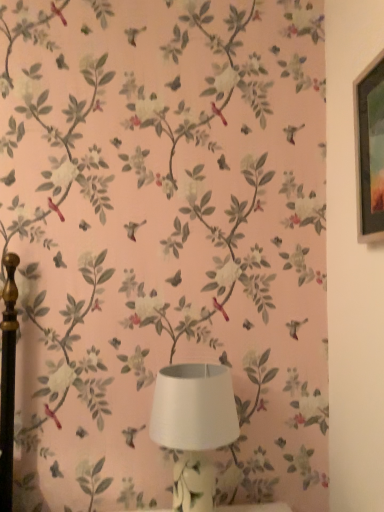
What do you see at coordinates (194, 426) in the screenshot? The width and height of the screenshot is (384, 512). I see `white matte lampshade at center` at bounding box center [194, 426].

Find the location of a particular element. This screenshot has width=384, height=512. white matte lampshade at center is located at coordinates (194, 426).

Measure the distance between metallic silver picture frame at upper right and camera.

metallic silver picture frame at upper right and camera are 38.04 inches apart.

What are the coordinates of `metallic silver picture frame at upper right` in the screenshot? It's located at (370, 150).

The height and width of the screenshot is (512, 384). Describe the element at coordinates (370, 150) in the screenshot. I see `metallic silver picture frame at upper right` at that location.

Find the location of a particular element. Image resolution: width=384 pixels, height=512 pixels. white matte lampshade at center is located at coordinates (194, 426).

Is white matte lampshade at center to the left of metallic silver picture frame at upper right from the viewer's perspective?

Indeed, white matte lampshade at center is positioned on the left side of metallic silver picture frame at upper right.

Is white matte lampshade at center closer to camera compared to metallic silver picture frame at upper right?

No, it is behind metallic silver picture frame at upper right.

Which is in front, point (160, 409) or point (366, 223)?

The point (366, 223) is in front.

From the image's perspective, which object appears higher, white matte lampshade at center or metallic silver picture frame at upper right?

metallic silver picture frame at upper right.

From a real-world perspective, between white matte lampshade at center and metallic silver picture frame at upper right, who is vertically lower?

white matte lampshade at center is physically lower.

Can you confirm if white matte lampshade at center is wider than metallic silver picture frame at upper right?

Yes.

Can you confirm if white matte lampshade at center is taller than metallic silver picture frame at upper right?

No.

Which of these two, white matte lampshade at center or metallic silver picture frame at upper right, is smaller?

With smaller size is metallic silver picture frame at upper right.

Based on the photo, is white matte lampshade at center not inside metallic silver picture frame at upper right?

Absolutely, white matte lampshade at center is external to metallic silver picture frame at upper right.

Would you consider white matte lampshade at center to be distant from metallic silver picture frame at upper right?

Actually, white matte lampshade at center and metallic silver picture frame at upper right are a little close together.

Is white matte lampshade at center facing towards metallic silver picture frame at upper right?

No.

Where is `lamp below the metallic silver picture frame at upper right (from the image's perspective)`? This screenshot has width=384, height=512. lamp below the metallic silver picture frame at upper right (from the image's perspective) is located at coordinates (194, 426).

Based on their positions, is metallic silver picture frame at upper right located to the left or right of white matte lampshade at center?

From the image, it's evident that metallic silver picture frame at upper right is to the right of white matte lampshade at center.

Does metallic silver picture frame at upper right lie behind white matte lampshade at center?

No, metallic silver picture frame at upper right is closer to the camera.

Which point is more distant from viewer, (x=378, y=198) or (x=188, y=456)?

The point (x=188, y=456) is farther from the camera.

From the image's perspective, between metallic silver picture frame at upper right and white matte lampshade at center, which one is located above?

metallic silver picture frame at upper right.

From a real-world perspective, is metallic silver picture frame at upper right positioned above or below white matte lampshade at center?

metallic silver picture frame at upper right is situated higher than white matte lampshade at center in the real world.

Which of these two, metallic silver picture frame at upper right or white matte lampshade at center, is thinner?

metallic silver picture frame at upper right is thinner.

Looking at this image, considering the sizes of objects metallic silver picture frame at upper right and white matte lampshade at center in the image provided, who is shorter, metallic silver picture frame at upper right or white matte lampshade at center?

Standing shorter between the two is white matte lampshade at center.

Between metallic silver picture frame at upper right and white matte lampshade at center, which one has larger size?

white matte lampshade at center.

Is metallic silver picture frame at upper right not within white matte lampshade at center?

Absolutely, metallic silver picture frame at upper right is external to white matte lampshade at center.

Would you consider metallic silver picture frame at upper right to be distant from white matte lampshade at center?

No, metallic silver picture frame at upper right is not far away from white matte lampshade at center.

Is metallic silver picture frame at upper right positioned with its back to white matte lampshade at center?

No, metallic silver picture frame at upper right is not facing the opposite direction of white matte lampshade at center.

Based on the photo, how much distance is there between metallic silver picture frame at upper right and white matte lampshade at center?

Result: metallic silver picture frame at upper right is 26.53 inches away from white matte lampshade at center.

The height and width of the screenshot is (512, 384). What are the coordinates of `lamp directly beneath the metallic silver picture frame at upper right (from a real-world perspective)` in the screenshot? It's located at (194, 426).

You are a GUI agent. You are given a task and a screenshot of the screen. Output one action in this format:
    pyautogui.click(x=<x>, y=<y>)
    Task: Click on the lamp that appears on the left of metallic silver picture frame at upper right
    Image resolution: width=384 pixels, height=512 pixels.
    Given the screenshot: What is the action you would take?
    click(x=194, y=426)

Locate an element on the screen. The height and width of the screenshot is (512, 384). picture frame in front of the white matte lampshade at center is located at coordinates (370, 150).